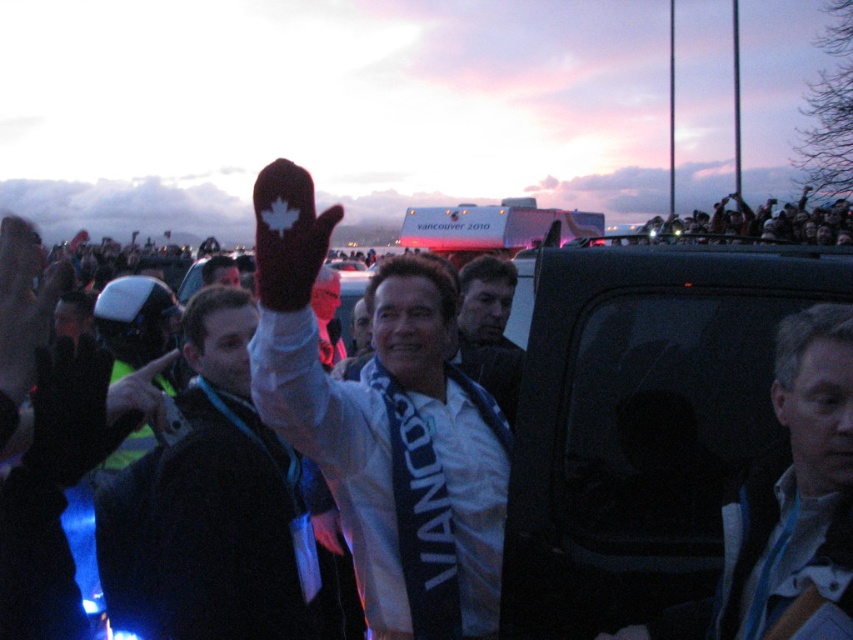
Question: Estimate the real-world distances between objects in this image. Which object is farther from the dark blue fabric shirt at center?

Choices:
 (A) light blue fabric scarf at center
 (B) dark blue fabric jacket at upper left

Answer: (A)

Question: From the image, what is the correct spatial relationship of light blue fabric scarf at center in relation to dark blue fabric shirt at center?

Choices:
 (A) left
 (B) right

Answer: (B)

Question: Which object is closer to the camera taking this photo?

Choices:
 (A) dark blue fabric jacket at upper left
 (B) matte red mitten at center
 (C) light blue fabric scarf at center

Answer: (C)

Question: Observing the image, what is the correct spatial positioning of matte red mitten at center in reference to light blue fabric scarf at center?

Choices:
 (A) above
 (B) below

Answer: (A)

Question: Is light blue fabric scarf at center to the left of dark blue fabric shirt at center from the viewer's perspective?

Choices:
 (A) no
 (B) yes

Answer: (A)

Question: Estimate the real-world distances between objects in this image. Which object is closer to the light blue fabric scarf at center?

Choices:
 (A) matte red mitten at center
 (B) dark blue fabric jacket at upper left
 (C) dark blue fabric shirt at center

Answer: (A)